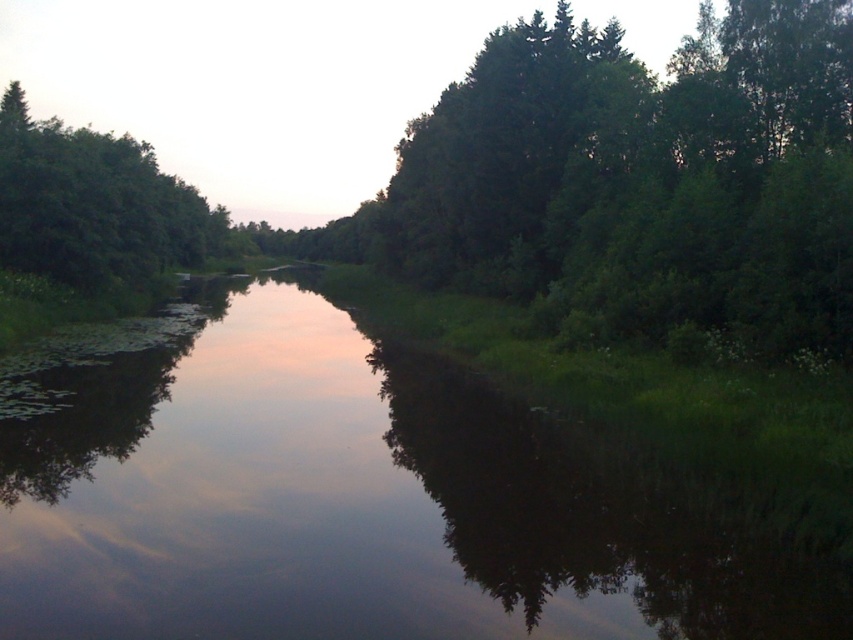
Question: Which point appears farthest from the camera in this image?

Choices:
 (A) (492, 524)
 (B) (119, 208)

Answer: (B)

Question: Does green grassy stream at center have a larger size compared to green leafy tree at left?

Choices:
 (A) yes
 (B) no

Answer: (B)

Question: Observing the image, what is the correct spatial positioning of green grassy stream at center in reference to green leafy tree at left?

Choices:
 (A) above
 (B) below

Answer: (B)

Question: In this image, where is green grassy stream at center located relative to green leafy tree at left?

Choices:
 (A) below
 (B) above

Answer: (A)